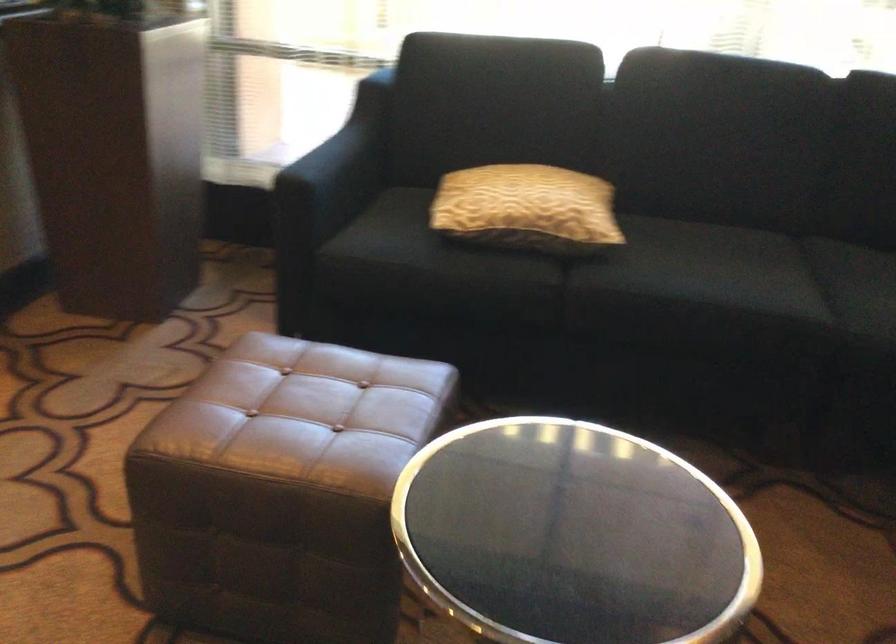
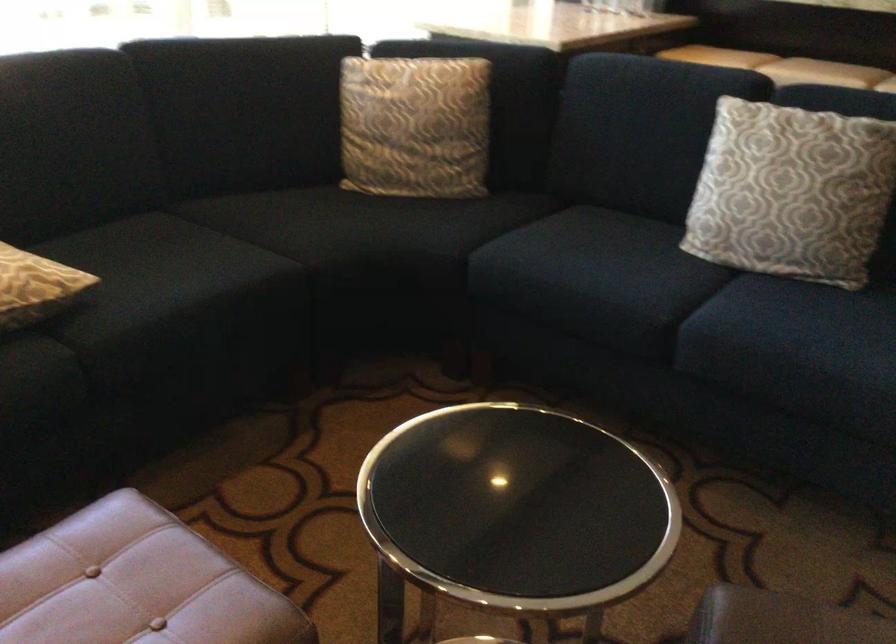
The point at [695,267] is marked in the first image. Where is the corresponding point in the second image?

(161, 270)